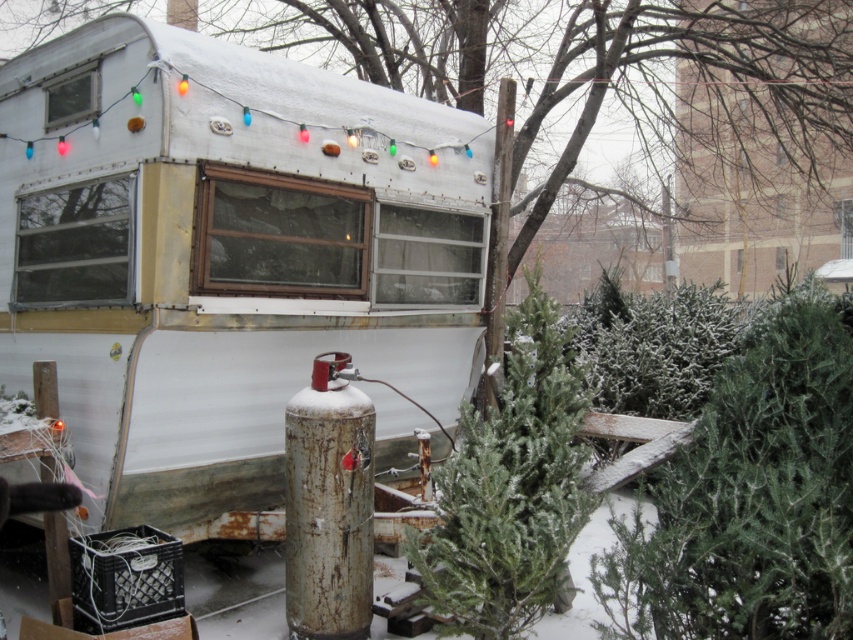
Question: Which object appears closest to the camera in this image?

Choices:
 (A) white matte trailer at upper left
 (B) green textured pine tree at center
 (C) green matte tree at center

Answer: (B)

Question: Can you confirm if white matte trailer at upper left is positioned above green matte tree at center?

Choices:
 (A) yes
 (B) no

Answer: (B)

Question: Which point appears farthest from the camera in this image?

Choices:
 (A) (544, 305)
 (B) (666, 384)
 (C) (125, 122)

Answer: (B)

Question: Does white matte trailer at upper left appear on the left side of green textured pine tree at center?

Choices:
 (A) no
 (B) yes

Answer: (B)

Question: Can you confirm if white matte trailer at upper left is positioned to the right of green matte tree at center?

Choices:
 (A) no
 (B) yes

Answer: (A)

Question: Which point is farther from the camera taking this photo?

Choices:
 (A) (447, 486)
 (B) (122, 381)
 (C) (386, 61)

Answer: (C)